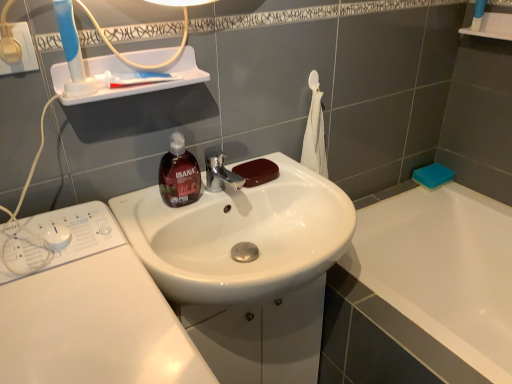
Question: Is point (193, 193) closer or farther from the camera than point (329, 249)?

Choices:
 (A) closer
 (B) farther

Answer: (B)

Question: Is translucent brown soap dispenser at center wider or thinner than white glossy sink at center?

Choices:
 (A) wide
 (B) thin

Answer: (B)

Question: Estimate the real-world distances between objects in this image. Which object is farther from the white glossy washing machine at lower left?

Choices:
 (A) blue plastic toothbrush at upper left
 (B) translucent brown soap dispenser at center
 (C) white glossy sink at center
 (D) blue sponge at right, which ranks as the first soap in back-to-front order
 (E) brown matte soap at sink, positioned as the second soap in back-to-front order

Answer: (D)

Question: Estimate the real-world distances between objects in this image. Which object is closer to the brown matte soap at sink, the second soap viewed from the right?

Choices:
 (A) white plastic socket at upper left
 (B) white glossy washing machine at lower left
 (C) translucent brown soap dispenser at center
 (D) blue plastic toothbrush at upper left
 (E) blue sponge at right, which ranks as the first soap in back-to-front order

Answer: (C)